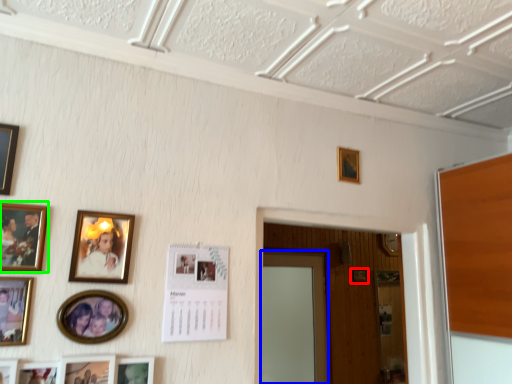
Question: Considering the real-world distances, which object is farthest from picture frame (highlighted by a red box)? door (highlighted by a blue box) or picture frame (highlighted by a green box)?

Choices:
 (A) door
 (B) picture frame

Answer: (B)